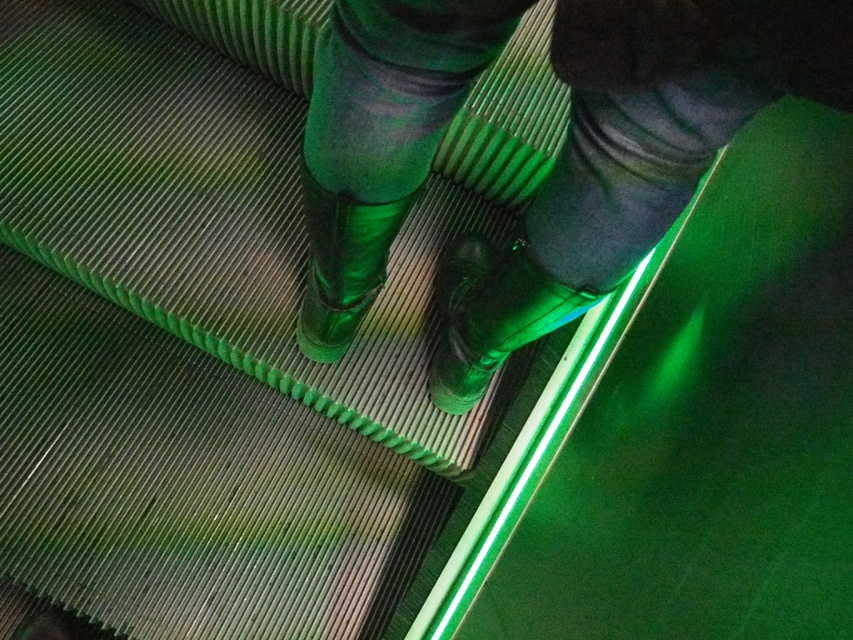
You are standing on the escalator and notice a bright green spot at point (630, 156). According to the image, what is located at that point?

The point (630, 156) is on green rubber boots at center.

You are standing at the bottom of the escalator and see the point marked at coordinates [491,314]. What object is located at that point?

The point at coordinates [491,314] corresponds to the matte black boot at center.